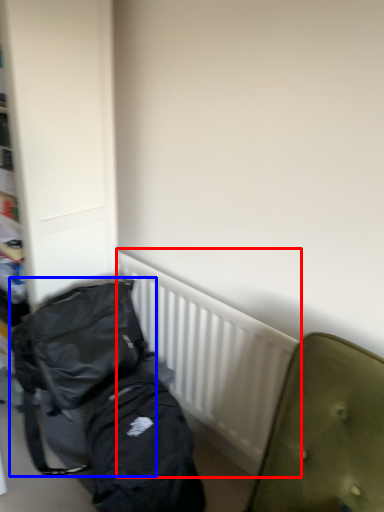
Question: Which point is further to the camera, radiator (highlighted by a red box) or backpack (highlighted by a blue box)?

Choices:
 (A) radiator
 (B) backpack

Answer: (A)